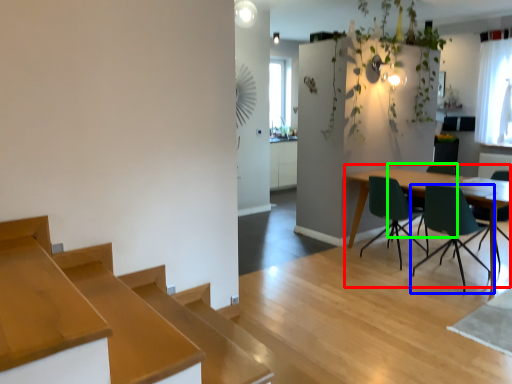
Question: Which object is positioned closest to table (highlighted by a red box)? Select from chair (highlighted by a blue box) and chair (highlighted by a green box).

Choices:
 (A) chair
 (B) chair

Answer: (A)